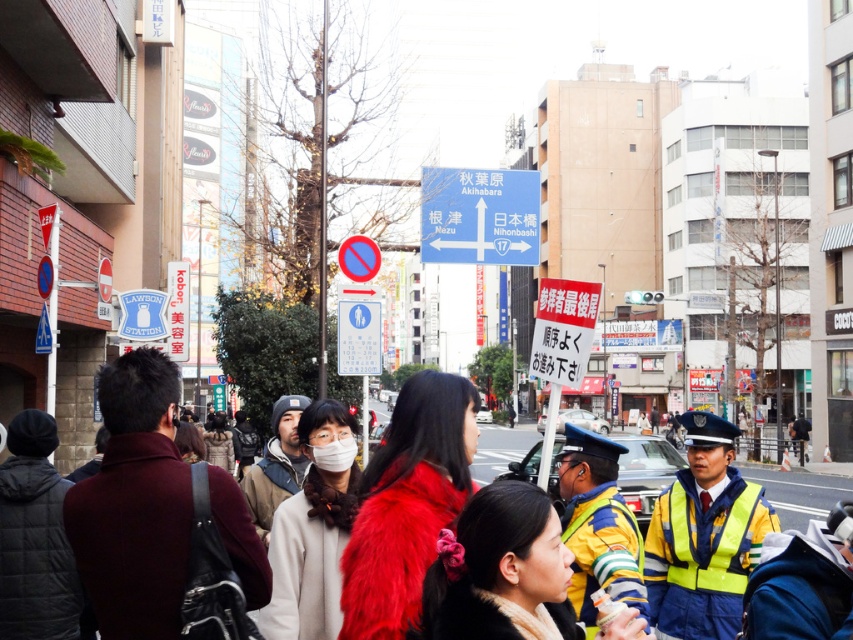
You are a pedestrian on the street and want to find the traffic officer wearing a white matte mask at center. Which direction should you look relative to the yellow reflective vest at right?

The yellow reflective vest at right is located below the white matte mask at center, so you should look above the yellow reflective vest at right to find the traffic officer wearing the white matte mask at center.